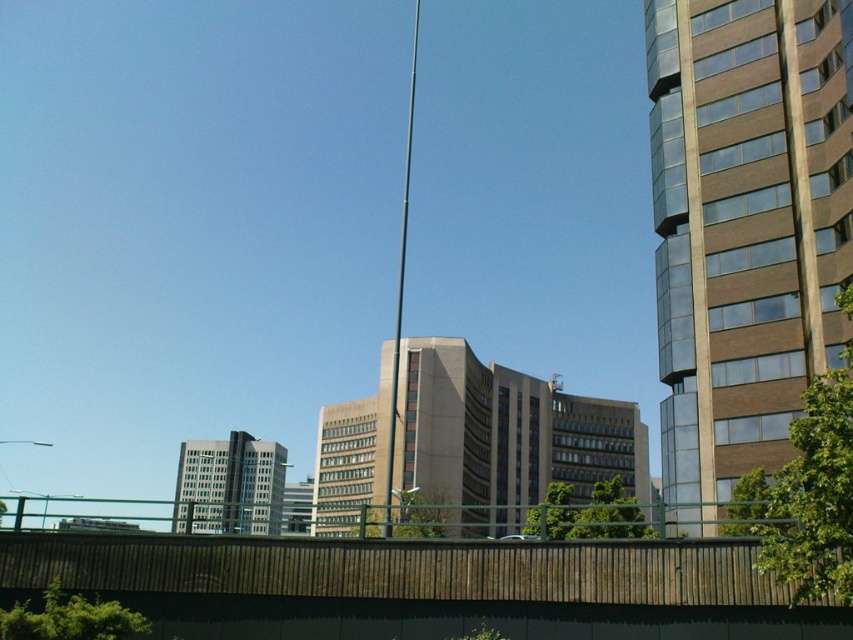
You are a city planner assessing the urban layout. You need to determine which object occupies more horizontal space in the scene. Based on the image, which is wider between the brown concrete building at right and the brown wooden fence at lower center?

The brown concrete building at right is wider than the brown wooden fence at lower center, as stated in the description.

You are standing on the bridge and see two points marked on the railing. The first point is at coordinates point(225, 493) and the second point is at point(390, 502). Which point is closer to you?

Point(390, 502) is closer to you because it is in front of point(225, 493).